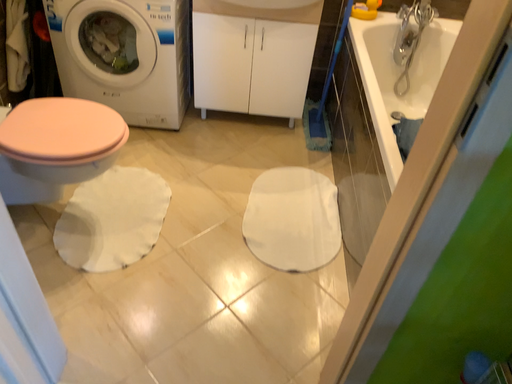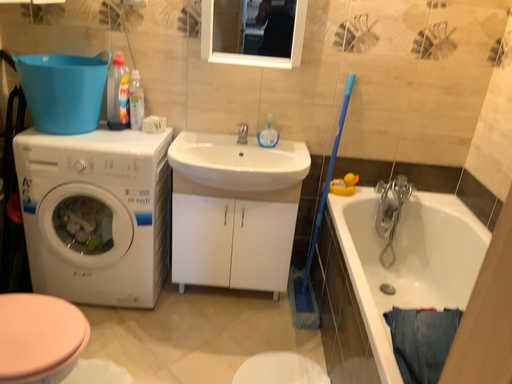
Question: How did the camera likely rotate when shooting the video?

Choices:
 (A) rotated downward
 (B) rotated upward

Answer: (B)